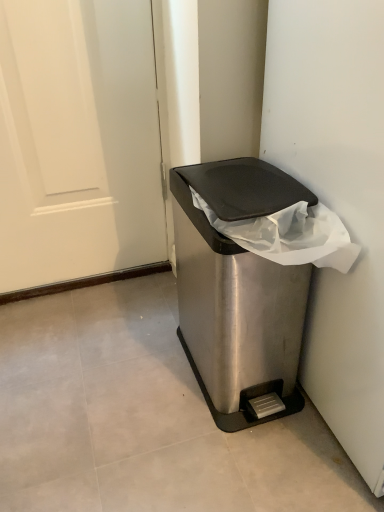
What do you see at coordinates (229, 314) in the screenshot? This screenshot has height=512, width=384. I see `satin silver trash can at lower right` at bounding box center [229, 314].

Image resolution: width=384 pixels, height=512 pixels. Identify the location of satin silver trash can at lower right. (229, 314).

Where is `satin silver trash can at lower right`? This screenshot has width=384, height=512. satin silver trash can at lower right is located at coordinates (229, 314).